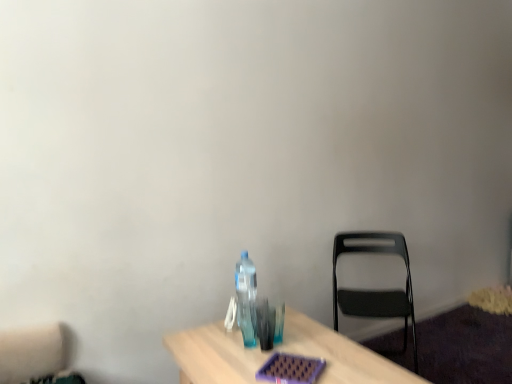
Question: From a real-world perspective, is transparent plastic bottle at center beneath black plastic chair at right?

Choices:
 (A) yes
 (B) no

Answer: (B)

Question: Considering the relative positions of transparent plastic bottle at center and black plastic chair at right in the image provided, is transparent plastic bottle at center to the left of black plastic chair at right from the viewer's perspective?

Choices:
 (A) yes
 (B) no

Answer: (A)

Question: Does transparent plastic bottle at center turn towards black plastic chair at right?

Choices:
 (A) yes
 (B) no

Answer: (A)

Question: Considering the relative sizes of transparent plastic bottle at center and black plastic chair at right in the image provided, is transparent plastic bottle at center thinner than black plastic chair at right?

Choices:
 (A) yes
 (B) no

Answer: (A)

Question: From a real-world perspective, is transparent plastic bottle at center positioned over black plastic chair at right based on gravity?

Choices:
 (A) no
 (B) yes

Answer: (B)

Question: Does transparent plastic bottle at center come behind black plastic chair at right?

Choices:
 (A) yes
 (B) no

Answer: (B)

Question: Considering the relative positions of black plastic chair at right and transparent plastic bottle at center in the image provided, is black plastic chair at right to the right of transparent plastic bottle at center from the viewer's perspective?

Choices:
 (A) no
 (B) yes

Answer: (B)

Question: Can you confirm if black plastic chair at right is smaller than transparent plastic bottle at center?

Choices:
 (A) yes
 (B) no

Answer: (B)

Question: Can you confirm if black plastic chair at right is wider than transparent plastic bottle at center?

Choices:
 (A) no
 (B) yes

Answer: (B)

Question: Is black plastic chair at right beside transparent plastic bottle at center?

Choices:
 (A) no
 (B) yes

Answer: (A)

Question: Is black plastic chair at right positioned beyond the bounds of transparent plastic bottle at center?

Choices:
 (A) no
 (B) yes

Answer: (B)

Question: From the image's perspective, is black plastic chair at right over transparent plastic bottle at center?

Choices:
 (A) no
 (B) yes

Answer: (A)

Question: Is transparent plastic bottle at center wider or thinner than black plastic chair at right?

Choices:
 (A) wide
 (B) thin

Answer: (B)